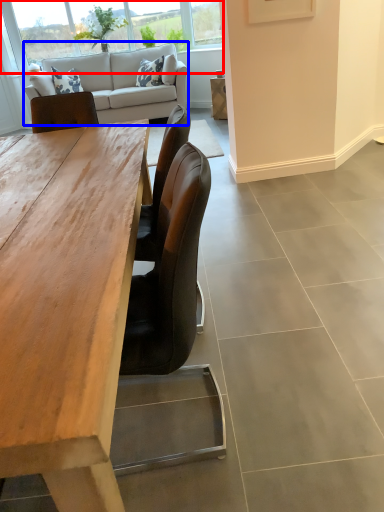
Question: Which point is further to the camera, window (highlighted by a red box) or studio couch (highlighted by a blue box)?

Choices:
 (A) window
 (B) studio couch

Answer: (A)